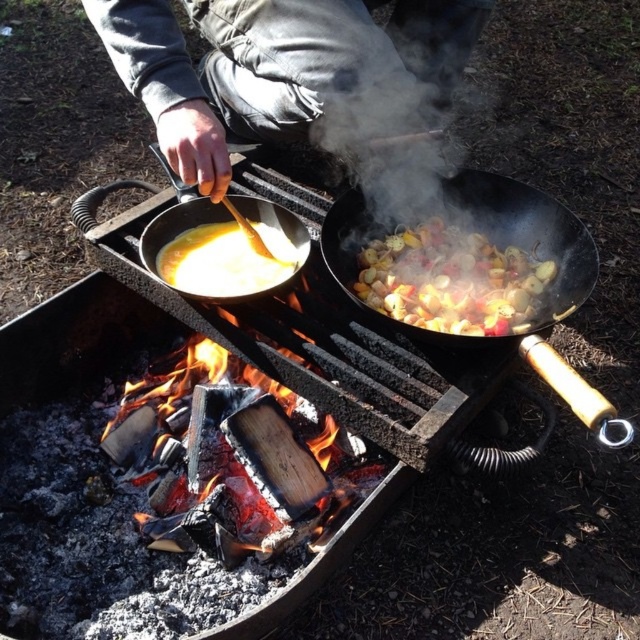
Question: Which point appears closest to the camera in this image?

Choices:
 (A) (186, 6)
 (B) (557, 316)
 (C) (196, 200)

Answer: (B)

Question: Which point appears farthest from the camera in this image?

Choices:
 (A) (420, 276)
 (B) (163, 241)
 (C) (576, 406)

Answer: (B)

Question: Which object is closer to the camera taking this photo?

Choices:
 (A) shiny metallic vegetables at center
 (B) matte black wok at center
 (C) gray fabric hand at upper center
 (D) black matte wok at center

Answer: (D)

Question: Is yellow creamy soup at center below matte black wok at center?

Choices:
 (A) no
 (B) yes

Answer: (B)

Question: Is shiny metallic vegetables at center closer to the viewer compared to matte black wok at center?

Choices:
 (A) no
 (B) yes

Answer: (A)

Question: Does yellow creamy soup at center appear on the right side of matte black wok at center?

Choices:
 (A) no
 (B) yes

Answer: (B)